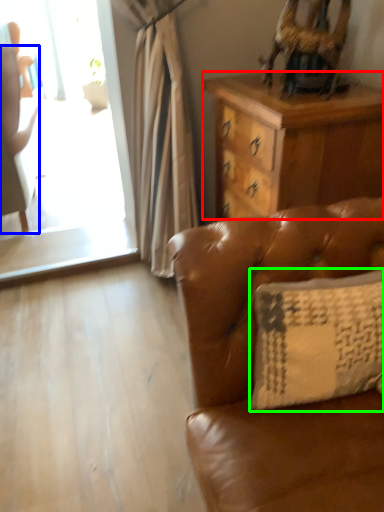
Question: Considering the real-world distances, which object is closest to desk (highlighted by a red box)? chair (highlighted by a blue box) or pillow (highlighted by a green box).

Choices:
 (A) chair
 (B) pillow

Answer: (B)